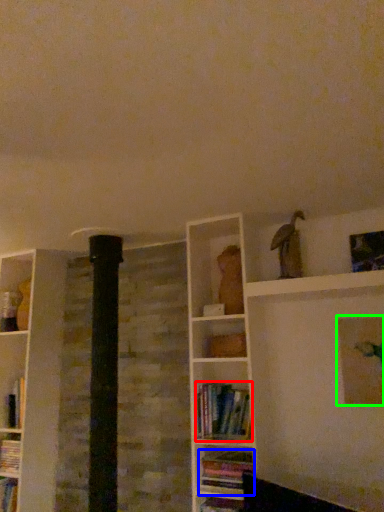
Question: Which is nearer to the book (highlighted by a red box)? book (highlighted by a blue box) or picture frame (highlighted by a green box).

Choices:
 (A) book
 (B) picture frame

Answer: (A)